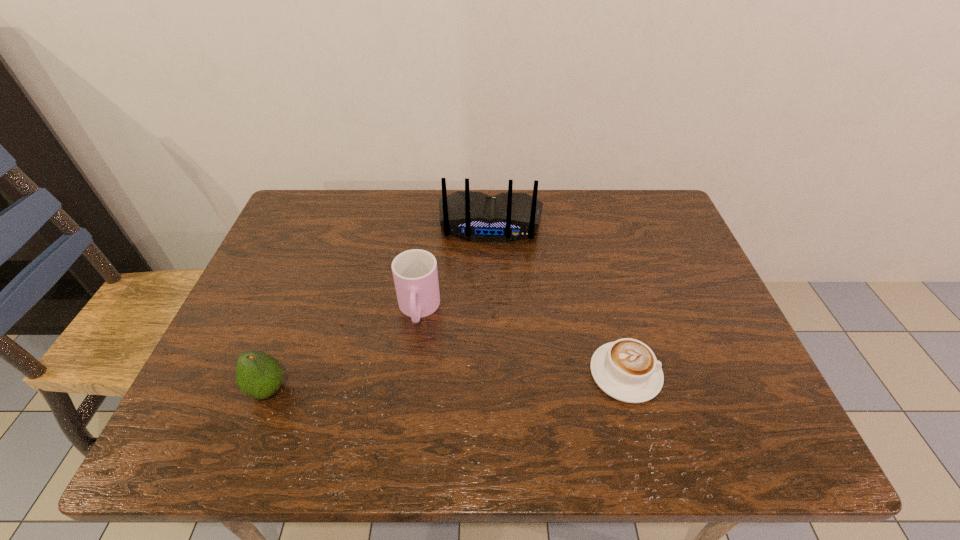
The width and height of the screenshot is (960, 540). In order to click on free location that satisfies the following two spatial constraints: 1. on the back side of the avocado; 2. on the right side of the cup in this screenshot , I will do `click(299, 310)`.